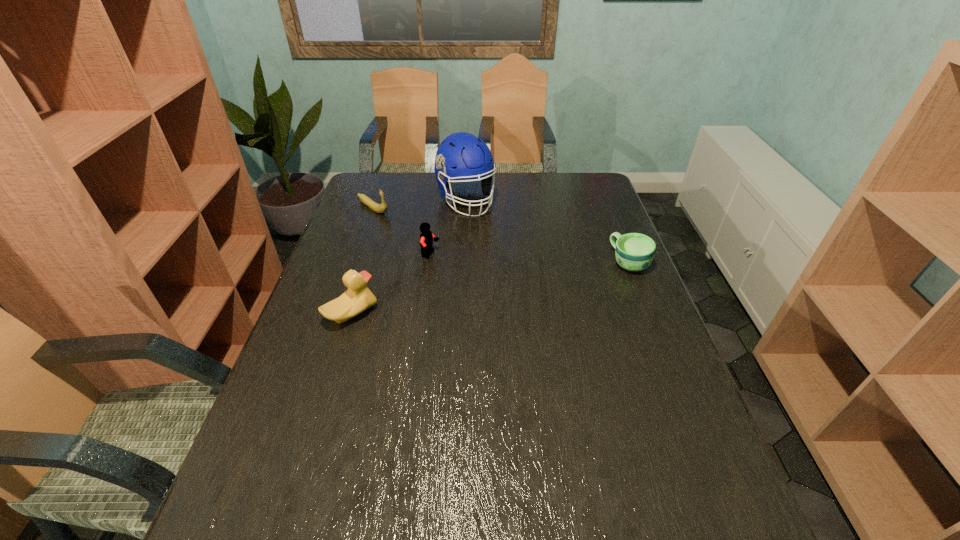
What are the coordinates of `the nearest object` in the screenshot? It's located at (358, 298).

Identify the location of the rightmost object. (634, 252).

The width and height of the screenshot is (960, 540). In order to click on cup in this screenshot , I will do `click(634, 252)`.

You are a GUI agent. You are given a task and a screenshot of the screen. Output one action in this format:
    pyautogui.click(x=<x>, y=<y>)
    Task: Click on the banana
    Image resolution: width=960 pixels, height=540 pixels.
    Given the screenshot: What is the action you would take?
    pyautogui.click(x=380, y=208)

Find the location of a particular element. The image size is (960, 540). Lego is located at coordinates (426, 237).

This screenshot has width=960, height=540. I want to click on the tallest object, so click(x=461, y=155).

Find the location of a particular element. free point located at the beak of the duck is located at coordinates (463, 314).

Identify the location of vacant point located 0.370m on the back of the rightmost object. This screenshot has height=540, width=960. (600, 190).

This screenshot has height=540, width=960. What are the coordinates of `free space located 0.320m at the stem of the banana` in the screenshot? It's located at (446, 254).

The width and height of the screenshot is (960, 540). I want to click on vacant space situated at the stem of the banana, so click(436, 247).